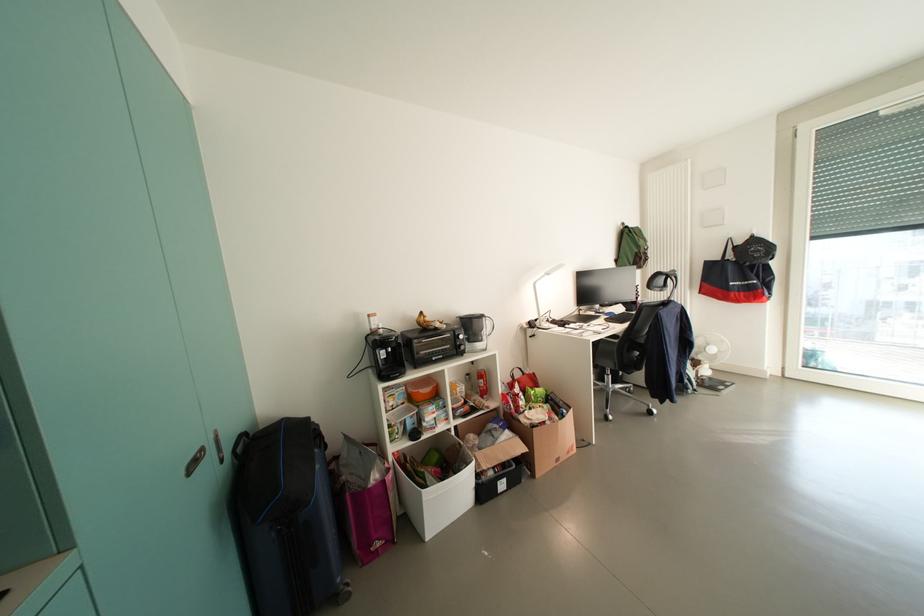
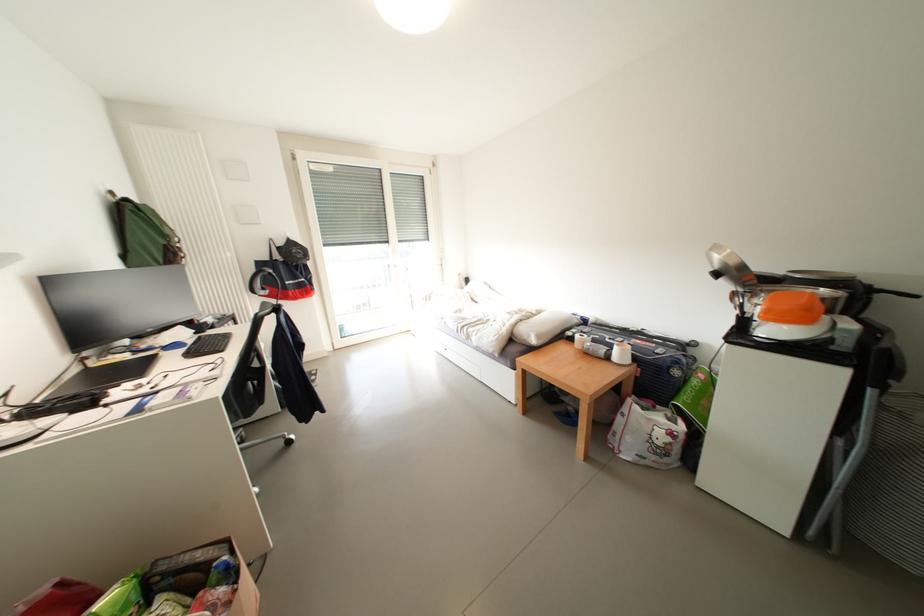
Question: The first image is from the beginning of the video and the second image is from the end. How did the camera likely rotate when shooting the video?

Choices:
 (A) Left
 (B) Right
 (C) Up
 (D) Down

Answer: (B)